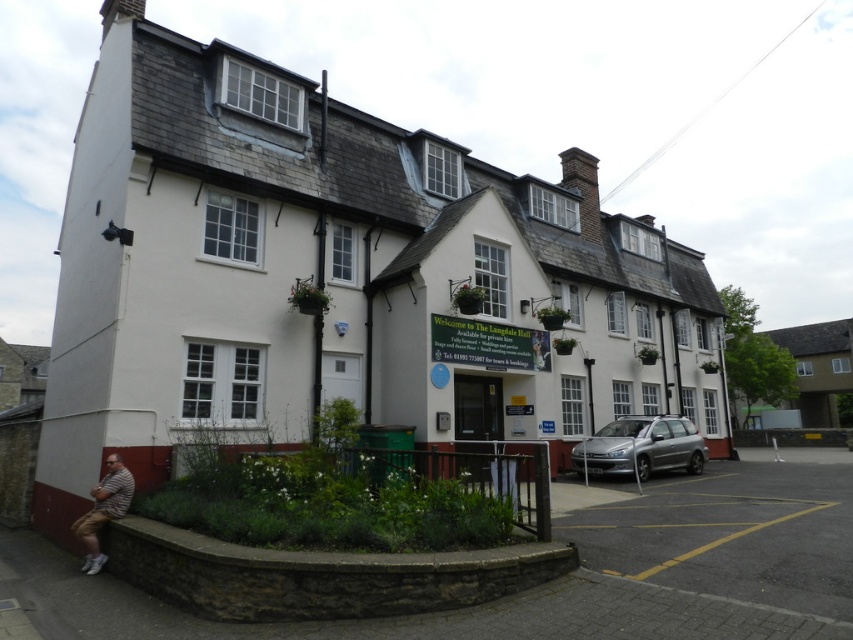
Question: Is satin silver car at lower right positioned in front of striped fabric at lower left?

Choices:
 (A) no
 (B) yes

Answer: (A)

Question: Can you confirm if satin silver car at lower right is smaller than striped fabric at lower left?

Choices:
 (A) no
 (B) yes

Answer: (A)

Question: Which of the following is the closest to the observer?

Choices:
 (A) satin silver car at lower right
 (B) striped fabric at lower left

Answer: (B)

Question: Is satin silver car at lower right smaller than striped fabric at lower left?

Choices:
 (A) no
 (B) yes

Answer: (A)